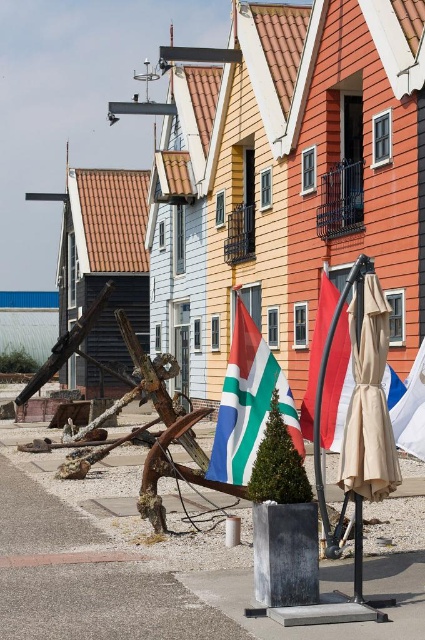
Does red fabric flag at center have a lesser height compared to blue fabric flag at center?

No.

Who is positioned more to the left, red fabric flag at center or blue fabric flag at center?

From the viewer's perspective, red fabric flag at center appears more on the left side.

Where is `red fabric flag at center`? The height and width of the screenshot is (640, 425). red fabric flag at center is located at coordinates (337, 387).

Image resolution: width=425 pixels, height=640 pixels. Describe the element at coordinates (248, 403) in the screenshot. I see `green and white striped flag at center` at that location.

Is green and white striped flag at center below red fabric flag at center?

No.

The image size is (425, 640). I want to click on green and white striped flag at center, so click(x=248, y=403).

Which is above, brown tile roof at upper left or beige fabric umbrella at center?

brown tile roof at upper left is higher up.

Find the location of `brown tile roof at upper left`. brown tile roof at upper left is located at coordinates (104, 256).

This screenshot has width=425, height=640. I want to click on brown tile roof at upper left, so click(104, 256).